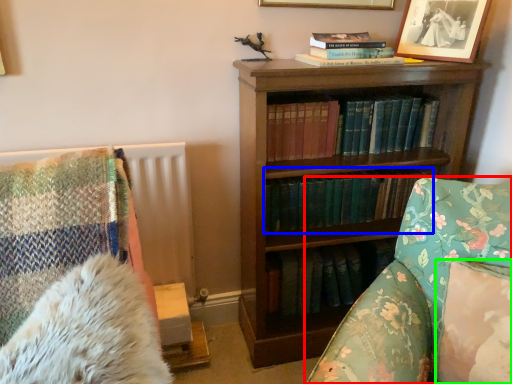
Question: Based on their relative distances, which object is farther from furniture (highlighted by a red box)? Choose from book (highlighted by a blue box) and pillow (highlighted by a green box).

Choices:
 (A) book
 (B) pillow

Answer: (A)